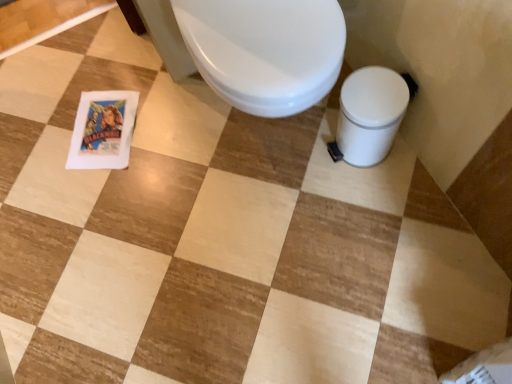
You are a GUI agent. You are given a task and a screenshot of the screen. Output one action in this format:
    pyautogui.click(x=<x>, y=<y>)
    Task: Click on the free space to the left of white glossy toilet bowl at lower right
    
    Given the screenshot: What is the action you would take?
    pyautogui.click(x=302, y=165)